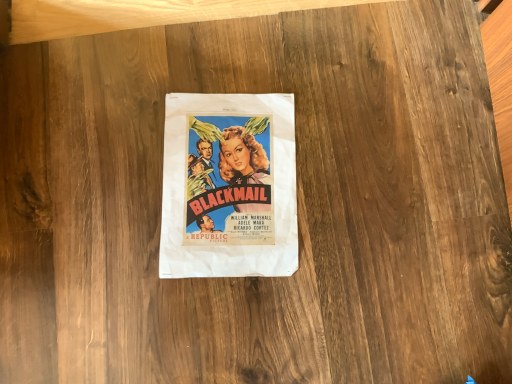
Describe the element at coordinates (229, 186) in the screenshot. I see `white paper poster at center` at that location.

Where is `white paper poster at center`? white paper poster at center is located at coordinates (229, 186).

I want to click on white paper poster at center, so click(229, 186).